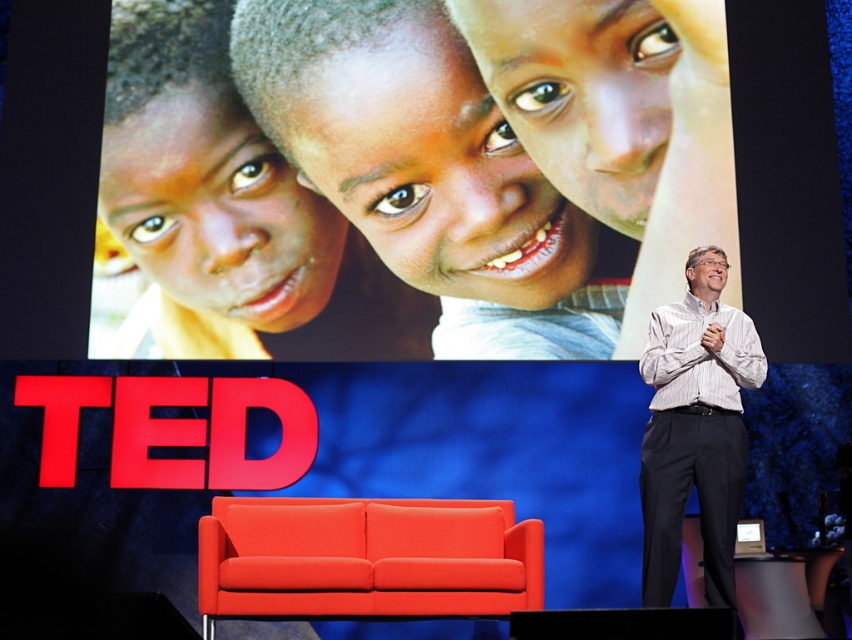
You are an event planner setting up a TED talk stage. You have a matte orange couch at lower center and a white striped shirt at right. Which object is shorter?

The matte orange couch at lower center is shorter than the white striped shirt at right.

You are a stagehand who needs to move a 4 feet wide equipment cart from the side of the stage to the area near the speaker. The cart must pass between the matte orange couch at lower center and the white striped shirt at right. Is there enough space for the cart to pass through?

The distance between the matte orange couch at lower center and the white striped shirt at right is 3.96 feet. Since the cart is 4 feet wide, there is not enough space for the cart to pass through.